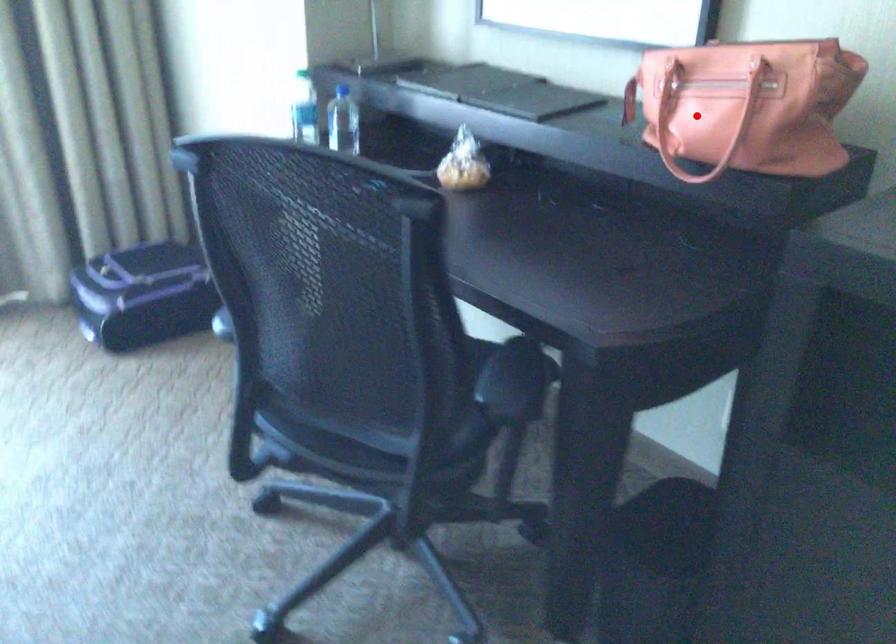
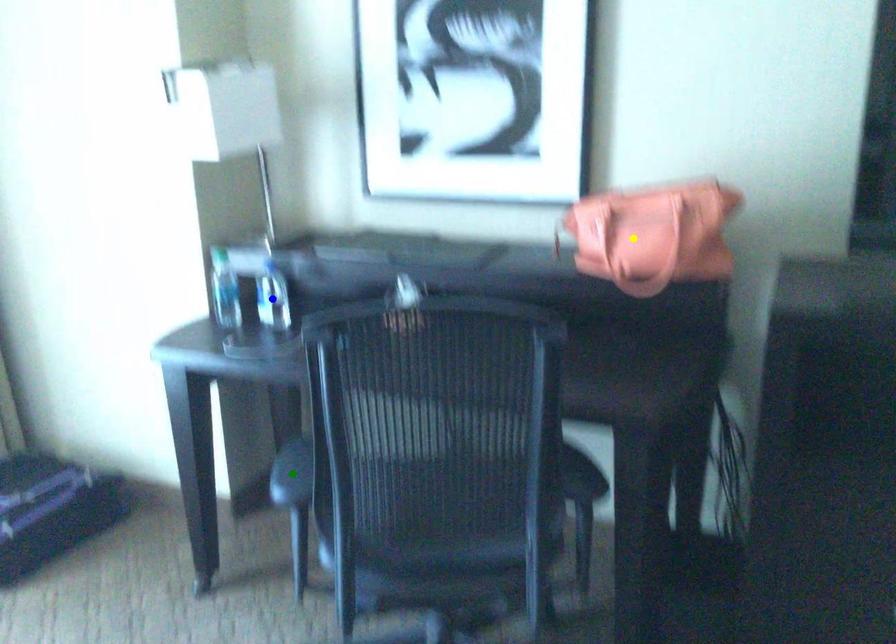
Question: I am providing you with two images of the same scene from different viewpoints. A red point is marked on the first image. You are given multiple points on the second image. Which mark in image 2 goes with the point in image 1?

Choices:
 (A) blue point
 (B) green point
 (C) yellow point

Answer: (C)